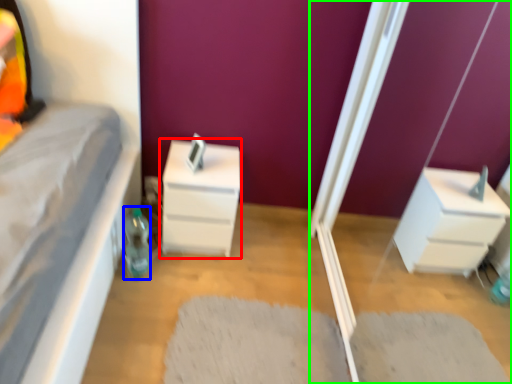
Question: Estimate the real-world distances between objects in this image. Which object is closer to chest of drawers (highlighted by a red box), bottle (highlighted by a blue box) or screen door (highlighted by a green box)?

Choices:
 (A) bottle
 (B) screen door

Answer: (A)